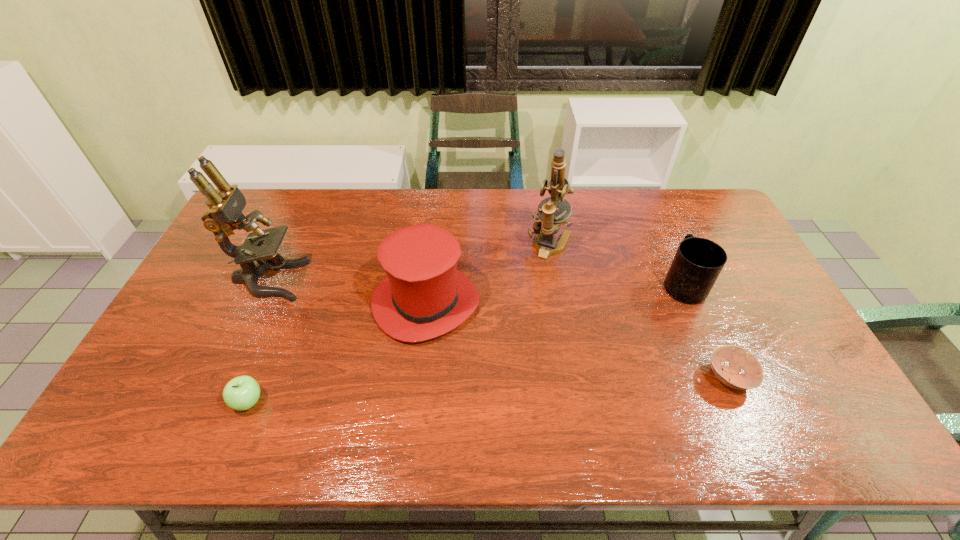
You are a GUI agent. You are given a task and a screenshot of the screen. Output one action in this format:
    pyautogui.click(x=<x>, y=<y>)
    Task: Click on the free space at the right edge of the desktop
    The image size is (960, 540).
    Given the screenshot: What is the action you would take?
    pyautogui.click(x=708, y=232)

This screenshot has height=540, width=960. In order to click on free region at the far right corner of the desktop in this screenshot , I will do `click(722, 215)`.

The image size is (960, 540). I want to click on unoccupied position between the apple and the fourth tallest object, so click(x=466, y=343).

Find the location of a particular element. The width and height of the screenshot is (960, 540). vacant space that's between the bowl and the second shortest object is located at coordinates (489, 389).

Identify the location of free space between the left microscope and the second shortest object. (258, 341).

Where is `free spot between the right microscope and the hat`? The width and height of the screenshot is (960, 540). free spot between the right microscope and the hat is located at coordinates (488, 274).

This screenshot has width=960, height=540. Identify the location of free space between the fourth object from left to right and the mug. (616, 265).

Find the location of a particular element. This screenshot has height=540, width=960. vacant space in between the hat and the shortest object is located at coordinates (577, 340).

Locate an element on the screen. The width and height of the screenshot is (960, 540). vacant space that's between the apple and the mug is located at coordinates (466, 343).

Image resolution: width=960 pixels, height=540 pixels. Identify the location of free space between the left microscope and the third tallest object. point(348,291).